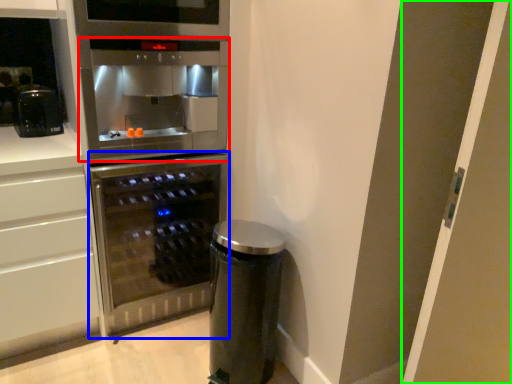
Question: Based on their relative distances, which object is farther from oven (highlighted by a red box)? Choose from home appliance (highlighted by a blue box) and glass door (highlighted by a green box).

Choices:
 (A) home appliance
 (B) glass door

Answer: (B)